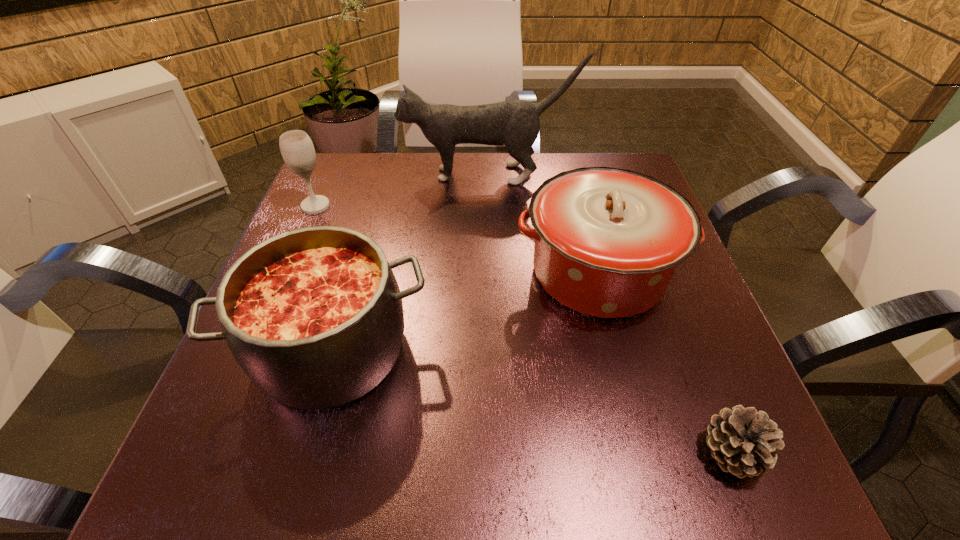
This screenshot has height=540, width=960. I want to click on empty space that is in between the fourth nearest object and the farthest object, so click(x=401, y=190).

Where is `free area in between the second farthest object and the shortest object`? This screenshot has width=960, height=540. free area in between the second farthest object and the shortest object is located at coordinates (523, 329).

Identify the location of free space between the fourth nearest object and the right casserole. The width and height of the screenshot is (960, 540). (457, 239).

At what (x,y) coordinates should I click in order to perform the action: click on empty space between the right casserole and the wineglass. Please return your answer as a coordinate pair (x, y). The image size is (960, 540). Looking at the image, I should click on (457, 239).

You are a GUI agent. You are given a task and a screenshot of the screen. Output one action in this format:
    pyautogui.click(x=<x>, y=<y>)
    Task: Click on the object that is the closest to the right casserole
    The image size is (960, 540).
    Given the screenshot: What is the action you would take?
    pyautogui.click(x=515, y=124)

Point out which object is positioned as the fourth nearest to the wineglass. Please provide its 2D coordinates. Your answer should be formatted as a tuple, i.e. [(x, y)], where the tuple contains the x and y coordinates of a point satisfying the conditions above.

[(743, 441)]

Image resolution: width=960 pixels, height=540 pixels. In order to click on vacant space that satisfies the following two spatial constraints: 1. at the face of the right casserole; 2. on the left side of the tallest object in this screenshot , I will do `click(490, 273)`.

Identify the location of vacant space that satisfies the following two spatial constraints: 1. at the face of the cat; 2. on the front side of the left casserole. The image size is (960, 540). (492, 349).

Find the location of `vacant space that satisfies the following two spatial constraints: 1. on the front side of the pinecone; 2. on the left side of the wineglass`. vacant space that satisfies the following two spatial constraints: 1. on the front side of the pinecone; 2. on the left side of the wineglass is located at coordinates (210, 452).

In order to click on vacant region that satisfies the following two spatial constraints: 1. at the face of the right casserole; 2. on the right side of the farthest object in this screenshot , I will do `click(490, 273)`.